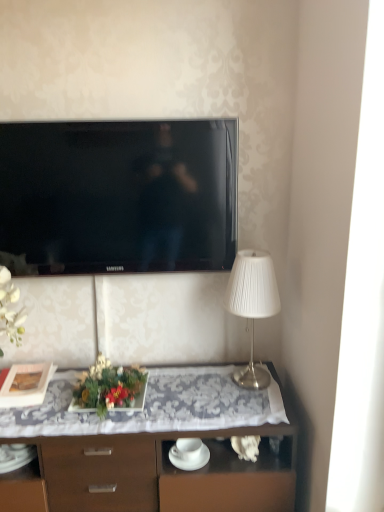
The width and height of the screenshot is (384, 512). Identify the location of free spot in front of white pleated fabric lampshade at right. (240, 408).